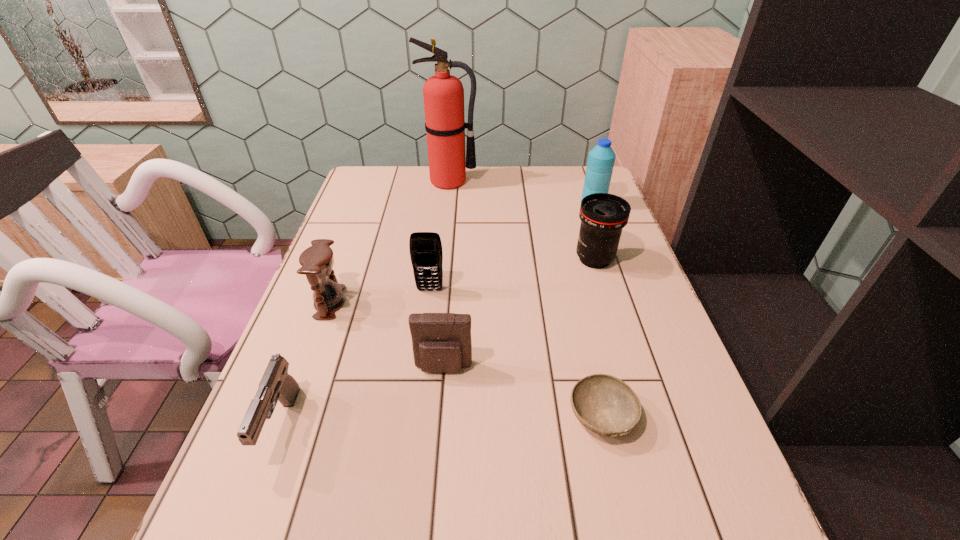
Identify the location of free space in the image that satisfies the following two spatial constraints: 1. at the nozzle of the second tallest object; 2. on the right side of the farthest object. (447, 204).

The image size is (960, 540). What are the coordinates of `vacant position in the image that satisfies the following two spatial constraints: 1. on the screen of the cellular telephone; 2. on the left side of the shortest object` in the screenshot? It's located at (414, 416).

The height and width of the screenshot is (540, 960). I want to click on free space that satisfies the following two spatial constraints: 1. at the nozzle of the seventh nearest object; 2. on the right side of the tallest object, so click(447, 204).